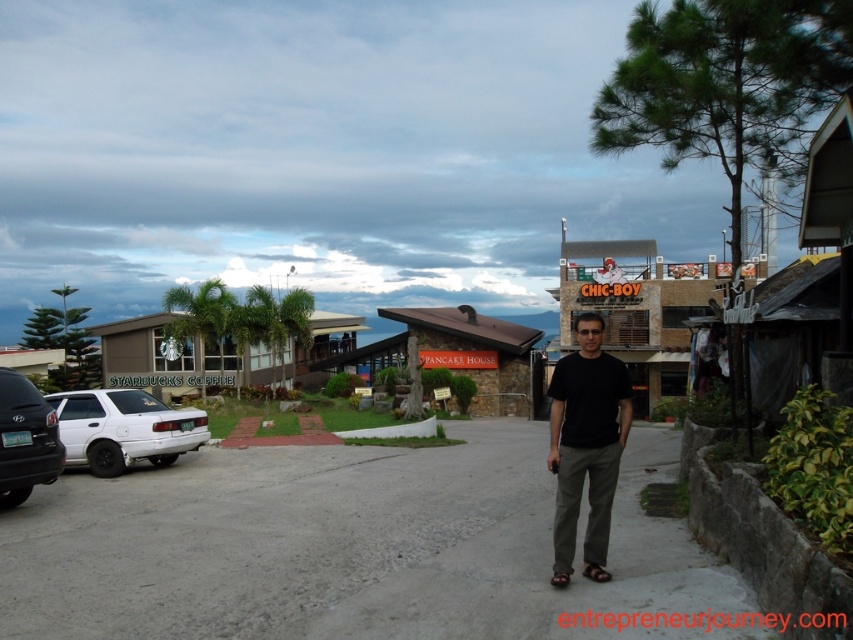
Can you confirm if white matte sedan at lower left is taller than matte black car at left?

In fact, white matte sedan at lower left may be shorter than matte black car at left.

Between white matte sedan at lower left and matte black car at left, which one has less height?

With less height is white matte sedan at lower left.

Where is `white matte sedan at lower left`? white matte sedan at lower left is located at coordinates (123, 428).

Which is above, brown leather sandal at center or brown leather sandal at lower right?

brown leather sandal at center

Between point (599, 572) and point (554, 579), which one is positioned in front?

Point (554, 579)

You are a GUI agent. You are given a task and a screenshot of the screen. Output one action in this format:
    pyautogui.click(x=<x>, y=<y>)
    Task: Click on the brown leather sandal at center
    
    Given the screenshot: What is the action you would take?
    pyautogui.click(x=595, y=572)

Which of these two, black matte shirt at center or white matte sedan at lower left, stands shorter?

With less height is white matte sedan at lower left.

Does black matte shirt at center have a greater height compared to white matte sedan at lower left?

Correct, black matte shirt at center is much taller as white matte sedan at lower left.

Who is more forward, (x=619, y=408) or (x=196, y=444)?

Positioned in front is point (x=619, y=408).

This screenshot has height=640, width=853. In order to click on black matte shirt at center in this screenshot , I will do `click(585, 440)`.